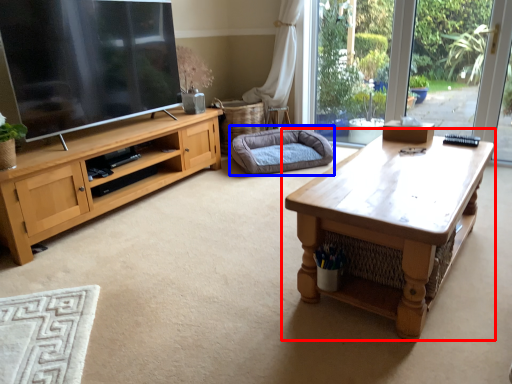
Question: Which object is closer to the camera taking this photo, coffee table (highlighted by a red box) or dog bed (highlighted by a blue box)?

Choices:
 (A) coffee table
 (B) dog bed

Answer: (A)